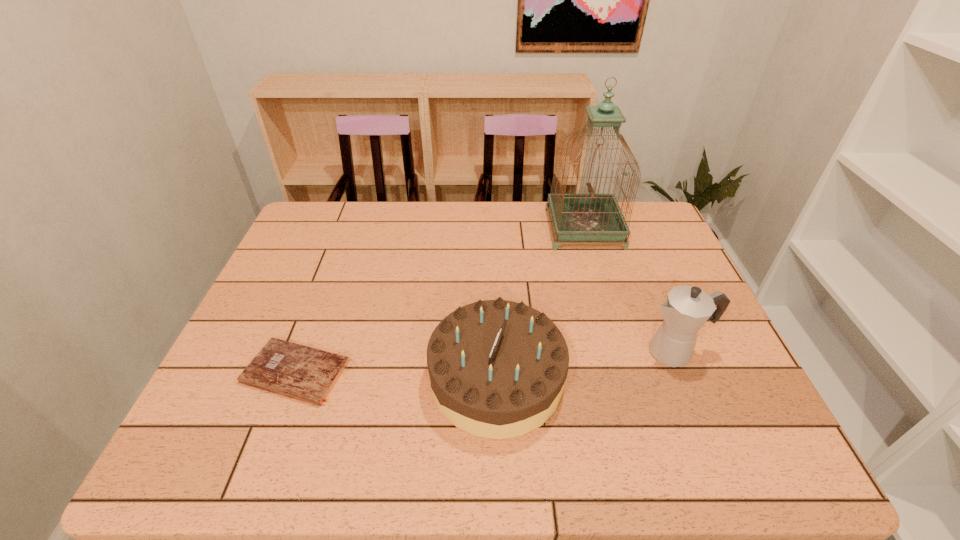
What are the coordinates of `free space located on the back of the second tallest object` in the screenshot? It's located at (633, 253).

Where is `free space located 0.050m on the front-facing side of the birthday cake`? This screenshot has width=960, height=540. free space located 0.050m on the front-facing side of the birthday cake is located at coordinates (408, 379).

Locate an element on the screen. blank area located on the front-facing side of the birthday cake is located at coordinates (267, 379).

Identify the location of free region located 0.090m on the front-facing side of the birthday cake. The image size is (960, 540). (391, 379).

This screenshot has width=960, height=540. Find the location of `vacant area situated on the back of the shortest object`. vacant area situated on the back of the shortest object is located at coordinates (324, 296).

Identify the location of object present at the far edge. (576, 217).

The width and height of the screenshot is (960, 540). Find the location of `object situated at the near edge`. object situated at the near edge is located at coordinates (497, 368).

Identify the location of object that is at the left edge. (292, 370).

Locate an element on the screen. birdcage that is at the right edge is located at coordinates (576, 217).

Locate an element on the screen. The image size is (960, 540). coffeepot present at the right edge is located at coordinates (686, 310).